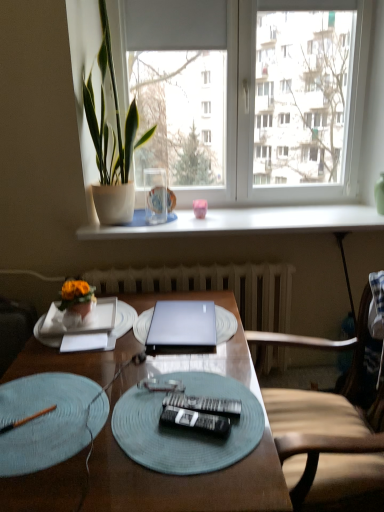
This screenshot has width=384, height=512. In order to click on empty space that is in between black plastic remote control at center, which is counted as the first remote control, starting from the back, and orange wood pen at lower left in this screenshot , I will do `click(96, 418)`.